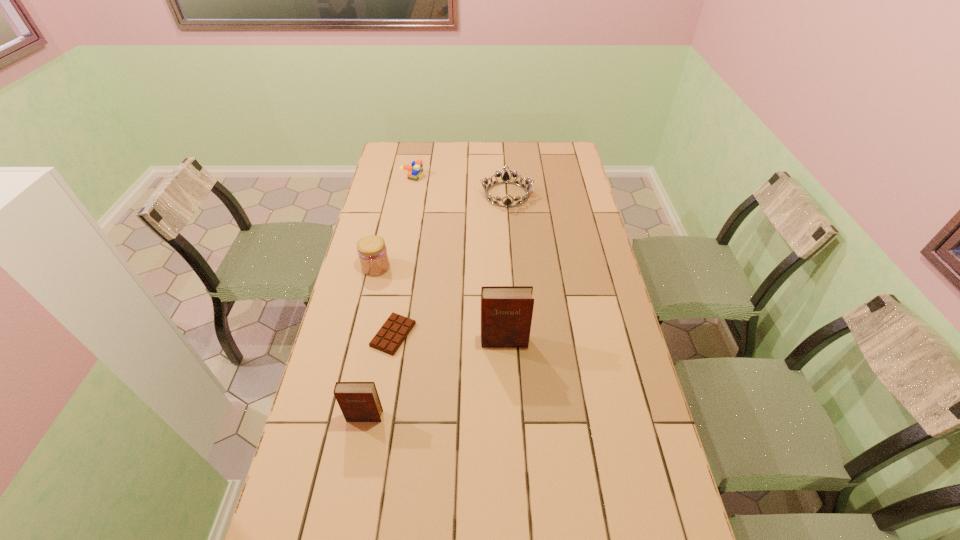
The width and height of the screenshot is (960, 540). What are the coordinates of `free point between the shortest object and the Lego` in the screenshot? It's located at (402, 255).

Identify the location of vacant space that is in between the tiara and the jam. (442, 231).

Where is `blank region between the taller diary and the tiara`? blank region between the taller diary and the tiara is located at coordinates (505, 268).

Where is `free space between the shortest object and the tiara`? The image size is (960, 540). free space between the shortest object and the tiara is located at coordinates (450, 265).

Locate an element on the screen. object that is the closest to the left diary is located at coordinates (391, 335).

Identify which object is the fifth closest to the fourth nearest object. Please provide its 2D coordinates. Your answer should be formatted as a tuple, i.e. [(x, y)], where the tuple contains the x and y coordinates of a point satisfying the conditions above.

[(359, 401)]